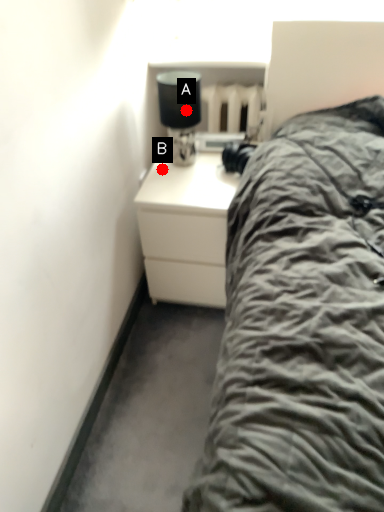
Question: Two points are circled on the image, labeled by A and B beside each circle. Among these points, which one is nearest to the camera?

Choices:
 (A) A is closer
 (B) B is closer

Answer: (A)